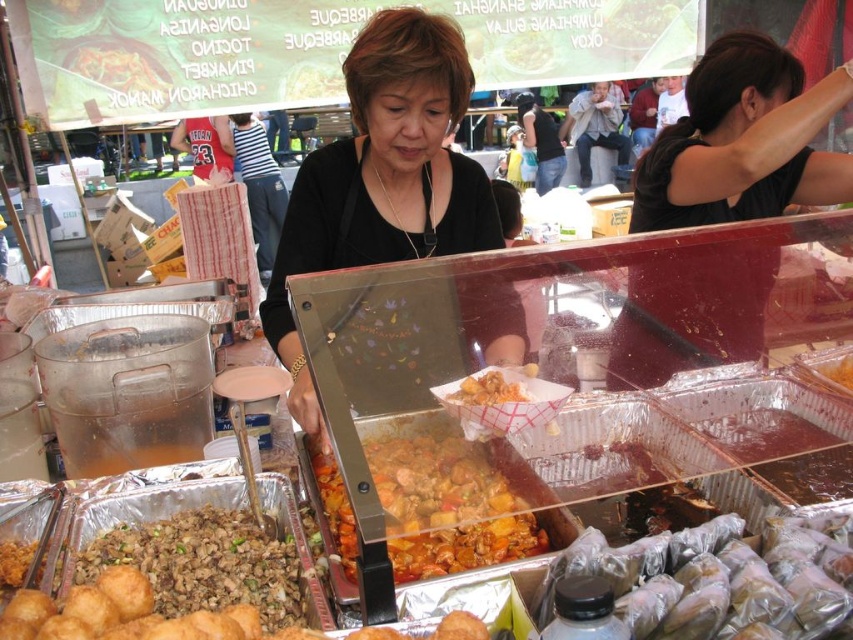
Does shiny silver foil at lower right have a lesser height compared to matte black tank top at center?

Yes, shiny silver foil at lower right is shorter than matte black tank top at center.

Is point (828, 593) more distant than point (544, 172)?

No, (828, 593) is in front of (544, 172).

Where is `shiny silver foil at lower right`? Image resolution: width=853 pixels, height=640 pixels. shiny silver foil at lower right is located at coordinates (717, 579).

Is black matte shirt at upper right above green leafy vegetables at center?

Actually, black matte shirt at upper right is below green leafy vegetables at center.

Does point (831, 93) come behind point (689, 8)?

No, (831, 93) is closer to viewer.

This screenshot has height=640, width=853. Find the location of `black matte shirt at upper right`. black matte shirt at upper right is located at coordinates (741, 141).

Which is more to the left, golden fried balls at lower left or green leafy vegetables at center?

golden fried balls at lower left is more to the left.

Is point (120, 614) less distant than point (605, 38)?

Yes, point (120, 614) is closer to viewer.

Locate an element on the screen. golden fried balls at lower left is located at coordinates (126, 616).